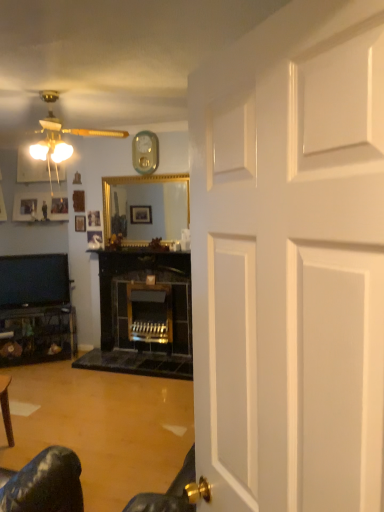
Question: Considering the relative sizes of metallic silver clock at upper center and matte black tv at left in the image provided, is metallic silver clock at upper center bigger than matte black tv at left?

Choices:
 (A) yes
 (B) no

Answer: (B)

Question: From a real-world perspective, is metallic silver clock at upper center positioned under matte black tv at left based on gravity?

Choices:
 (A) yes
 (B) no

Answer: (B)

Question: From a real-world perspective, is metallic silver clock at upper center on top of matte black tv at left?

Choices:
 (A) no
 (B) yes

Answer: (B)

Question: Is there a large distance between metallic silver clock at upper center and matte black tv at left?

Choices:
 (A) yes
 (B) no

Answer: (A)

Question: Is metallic silver clock at upper center to the left of matte black tv at left from the viewer's perspective?

Choices:
 (A) yes
 (B) no

Answer: (B)

Question: Based on their positions, is wooden picture frame at center, the first picture frame when ordered from front to back, located to the left or right of metallic silver clock at upper center?

Choices:
 (A) right
 (B) left

Answer: (B)

Question: From the image's perspective, is wooden picture frame at center, arranged as the fourth picture frame when viewed from the back, located above or below metallic silver clock at upper center?

Choices:
 (A) below
 (B) above

Answer: (A)

Question: Is wooden picture frame at center, which is counted as the 1th picture frame, starting from the right, bigger or smaller than metallic silver clock at upper center?

Choices:
 (A) big
 (B) small

Answer: (B)

Question: Looking at their shapes, would you say wooden picture frame at center, which is counted as the 1th picture frame, starting from the right, is wider or thinner than metallic silver clock at upper center?

Choices:
 (A) wide
 (B) thin

Answer: (A)

Question: Is wooden picture frame at center, arranged as the fourth picture frame when viewed from the back, wider or thinner than matte black tv at left?

Choices:
 (A) thin
 (B) wide

Answer: (A)

Question: In terms of height, does wooden picture frame at center, the first picture frame when ordered from front to back, look taller or shorter compared to matte black tv at left?

Choices:
 (A) short
 (B) tall

Answer: (A)

Question: Is wooden picture frame at center, the fourth picture frame positioned from the left, to the left or to the right of matte black tv at left in the image?

Choices:
 (A) left
 (B) right

Answer: (B)

Question: Is wooden picture frame at center, arranged as the fourth picture frame when viewed from the back, bigger or smaller than matte black tv at left?

Choices:
 (A) big
 (B) small

Answer: (B)

Question: Considering the positions of point (77, 221) and point (94, 245), is point (77, 221) closer or farther from the camera than point (94, 245)?

Choices:
 (A) farther
 (B) closer

Answer: (A)

Question: Looking at the image, does wooden picture frame at upper left, arranged as the 3th picture frame when viewed from the left, seem bigger or smaller compared to wooden picture frame at center, the first picture frame when ordered from front to back?

Choices:
 (A) small
 (B) big

Answer: (A)